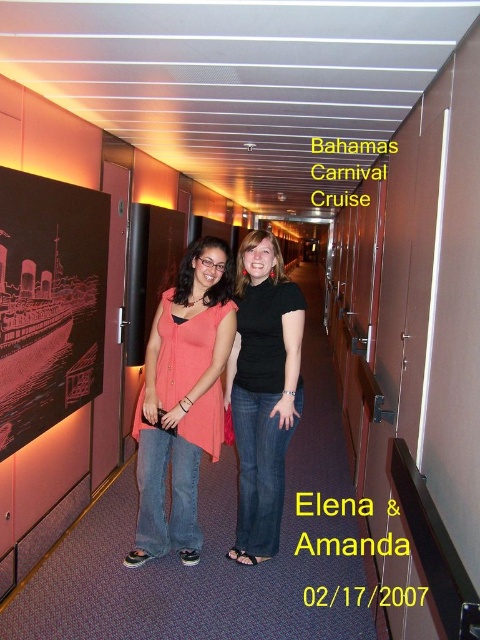
How far apart are matte pink top at center and black matte t-shirt at center?

matte pink top at center is 10.63 inches away from black matte t-shirt at center.

Between matte pink top at center and black matte t-shirt at center, which one has less height?

matte pink top at center

The width and height of the screenshot is (480, 640). In order to click on matte pink top at center in this screenshot , I will do `click(181, 401)`.